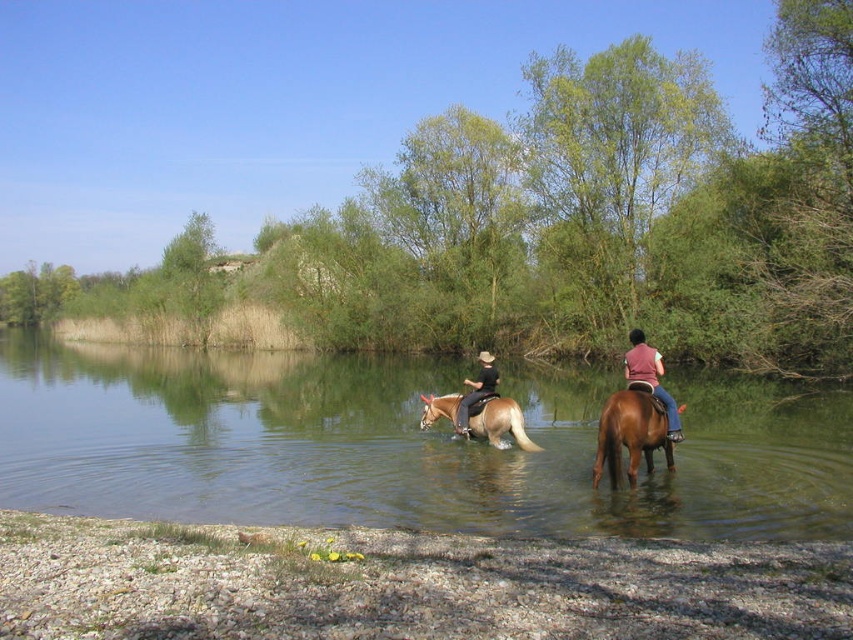
Between point (569, 484) and point (492, 419), which one is positioned in front?

Point (569, 484)

Does clear water at center have a lesser height compared to light brown glossy horse at center?

Incorrect, clear water at center's height does not fall short of light brown glossy horse at center's.

Where is `clear water at center`? This screenshot has height=640, width=853. clear water at center is located at coordinates (398, 445).

Can you confirm if brown leather vest at center is wider than dark brown leather pants at center?

Correct, the width of brown leather vest at center exceeds that of dark brown leather pants at center.

Is brown leather vest at center to the right of dark brown leather pants at center from the viewer's perspective?

Indeed, brown leather vest at center is positioned on the right side of dark brown leather pants at center.

Is point (668, 424) positioned behind point (485, 388)?

No.

You are a GUI agent. You are given a task and a screenshot of the screen. Output one action in this format:
    pyautogui.click(x=<x>, y=<y>)
    Task: Click on the brown leather vest at center
    The image size is (853, 640).
    Given the screenshot: What is the action you would take?
    pyautogui.click(x=651, y=378)

Who is shorter, clear water at center or brown leather vest at center?

With less height is clear water at center.

Does clear water at center have a lesser height compared to brown leather vest at center?

Yes.

Is point (335, 404) positioned before point (665, 392)?

That is False.

Locate an element on the screen. clear water at center is located at coordinates (398, 445).